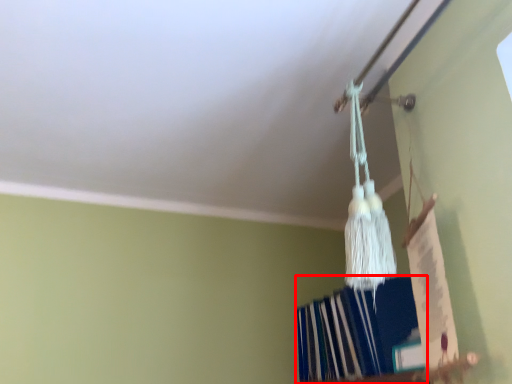
Question: In this image, where is book (annotated by the red box) located relative to trim?

Choices:
 (A) right
 (B) left

Answer: (A)